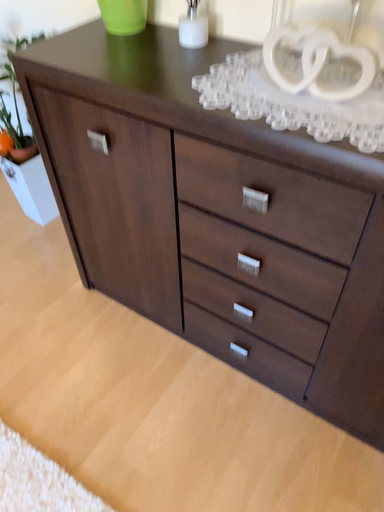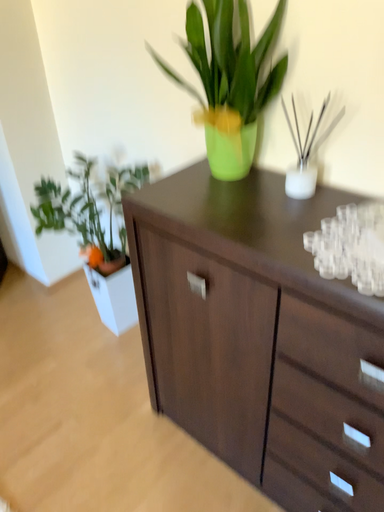
Question: Which way did the camera rotate in the video?

Choices:
 (A) rotated upward
 (B) rotated downward

Answer: (A)